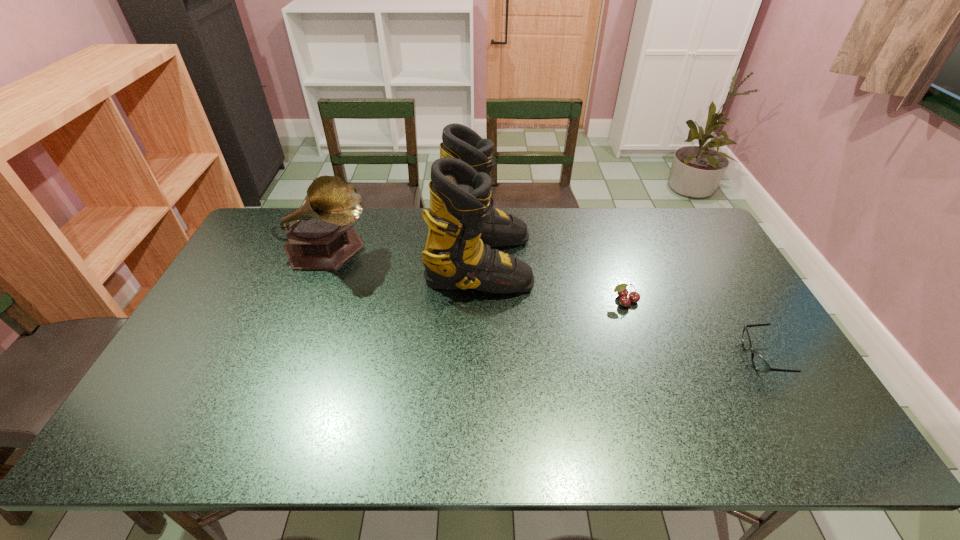
Image resolution: width=960 pixels, height=540 pixels. I want to click on vacant area at the near edge of the desktop, so click(x=625, y=440).

Identify the location of vacant space at the left edge of the desktop. (188, 335).

The width and height of the screenshot is (960, 540). I want to click on vacant space at the right edge of the desktop, so (734, 340).

Image resolution: width=960 pixels, height=540 pixels. Find the location of `vacant space at the far left corner of the desktop`. vacant space at the far left corner of the desktop is located at coordinates (276, 231).

The width and height of the screenshot is (960, 540). I want to click on vacant region at the far right corner of the desktop, so click(x=718, y=249).

Locate an element on the screen. blank space at the near right corner of the desktop is located at coordinates (809, 443).

Image resolution: width=960 pixels, height=540 pixels. I want to click on vacant area between the third object from right to left and the second tallest object, so click(403, 256).

The image size is (960, 540). I want to click on empty space between the second shortest object and the tallest object, so click(x=552, y=281).

At what (x,y) coordinates should I click in order to perform the action: click on free spot between the phonograph record and the rightmost object. Please return your answer as a coordinate pair (x, y). This screenshot has height=540, width=960. Looking at the image, I should click on (544, 304).

Where is `free space between the spectacles and the tallest object`? free space between the spectacles and the tallest object is located at coordinates (620, 309).